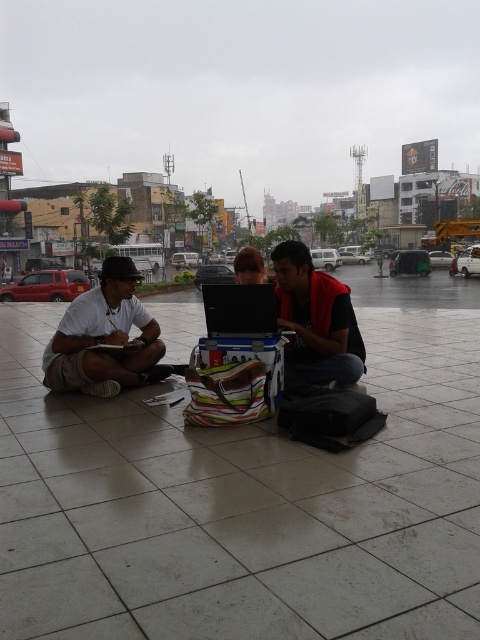
You are standing at the point with coordinates point (105,326) and want to walk to the point with coordinates point (416,602). Which direction should you move to reach your destination?

To reach point (416,602) from point (105,326), you should move forward since point (416,602) is in front of point (105,326).

You are standing at the point marked by the coordinates point [242,504] in the image. What is the object located at this point?

The object located at point [242,504] is the white tile pavement at center.